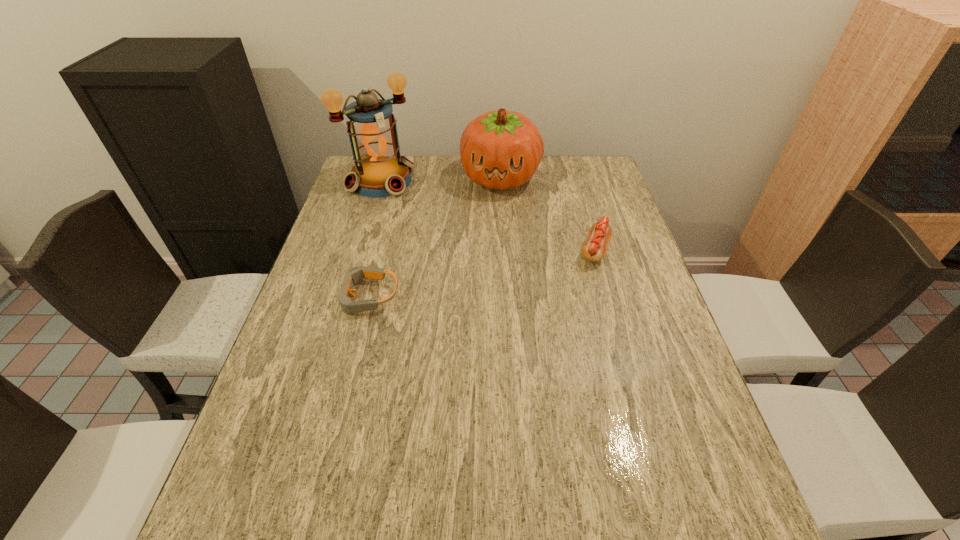
The image size is (960, 540). I want to click on unoccupied area between the second object from right to left and the nearest object, so click(434, 237).

The width and height of the screenshot is (960, 540). I want to click on free space that is in between the shortest object and the tallest object, so click(x=374, y=239).

The height and width of the screenshot is (540, 960). In order to click on vacant area that lies between the nearest object and the tallest object in this screenshot , I will do `click(374, 239)`.

Where is `free point between the lantern and the rightmost object`? The image size is (960, 540). free point between the lantern and the rightmost object is located at coordinates (488, 215).

Image resolution: width=960 pixels, height=540 pixels. Identify the location of vacant area between the shortest object and the pumpkin. (434, 237).

Locate an element on the screen. The width and height of the screenshot is (960, 540). unoccupied position between the nearest object and the tallest object is located at coordinates (374, 239).

Identify the location of free space between the sausage and the second object from right to left. Image resolution: width=960 pixels, height=540 pixels. (548, 214).

Locate an element on the screen. The width and height of the screenshot is (960, 540). empty space that is in between the tallest object and the shortest object is located at coordinates (374, 239).

Find the location of a particular element. The height and width of the screenshot is (540, 960). free space between the third tallest object and the pumpkin is located at coordinates (548, 214).

In order to click on object that is the second closest to the third tallest object in this screenshot , I will do `click(355, 274)`.